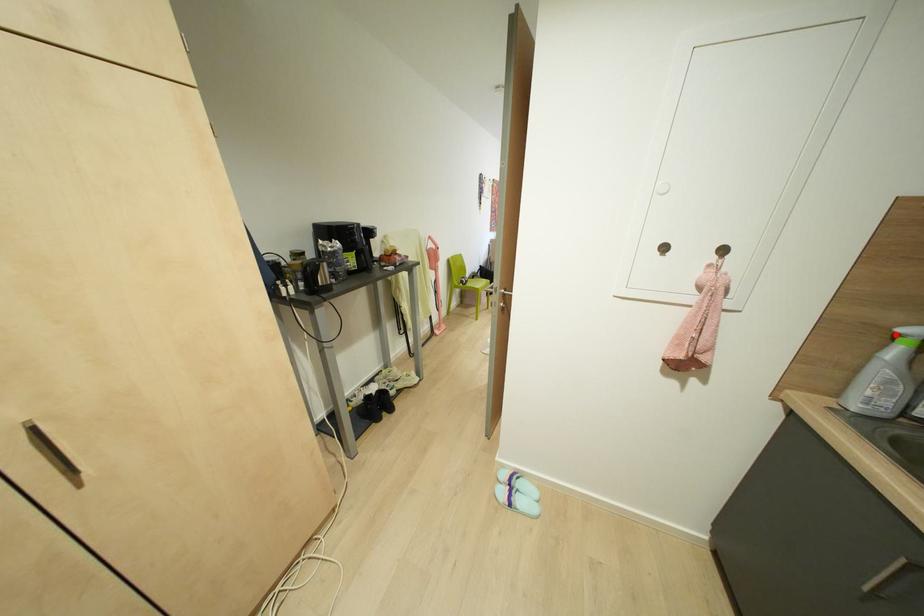
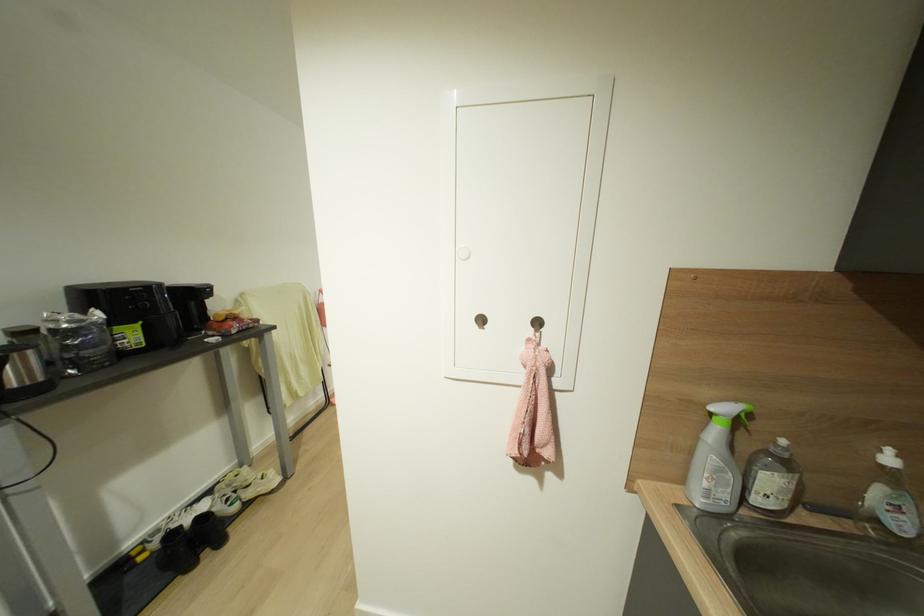
In the second image, find the point that corresponds to the highlighted location in the first image.

(711, 411)